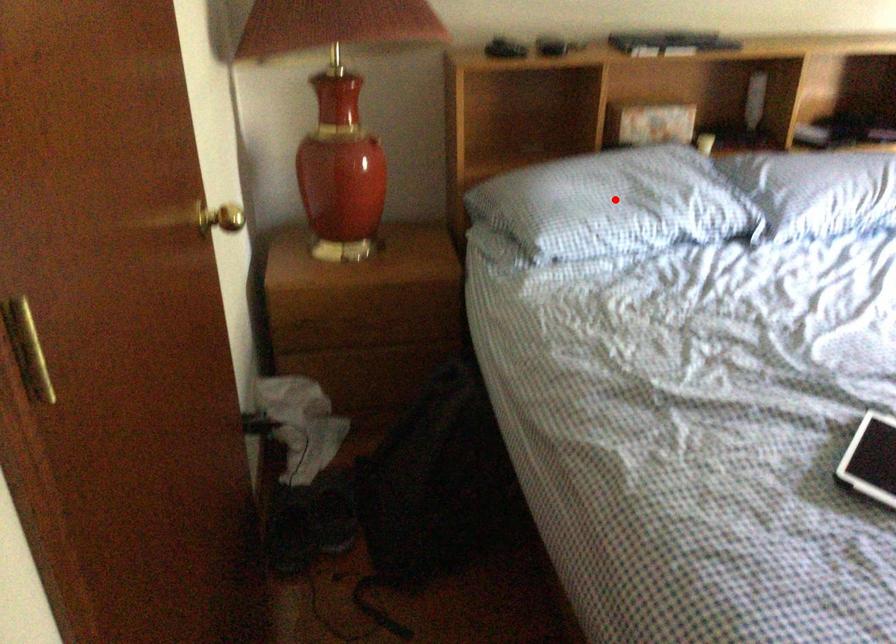
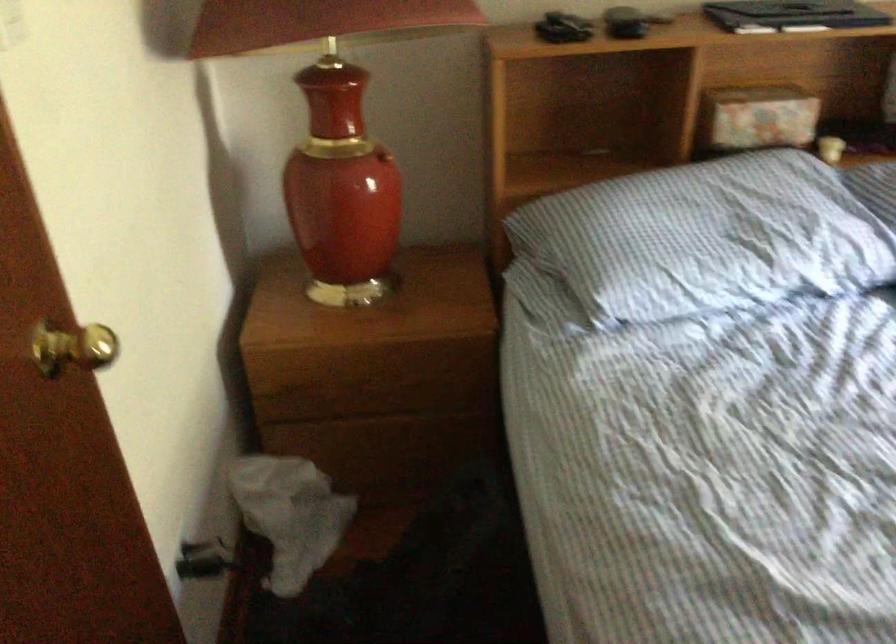
Question: I am providing you with two images of the same scene from different viewpoints. A red point is marked on the first image. Can you still see the location of the red point in image 2?

Choices:
 (A) Yes
 (B) No

Answer: (A)